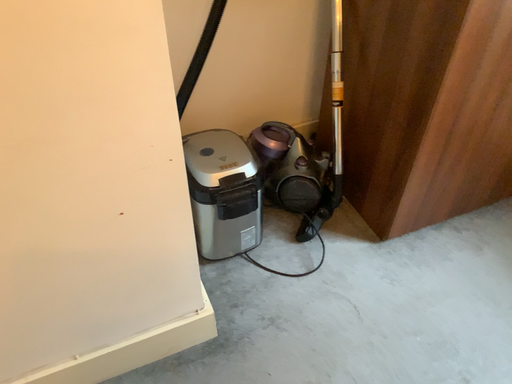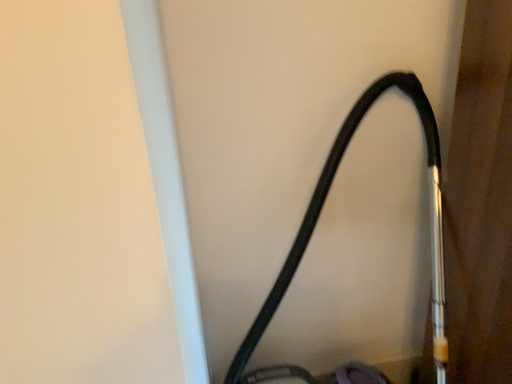
Question: Which way did the camera rotate in the video?

Choices:
 (A) rotated left
 (B) rotated right

Answer: (A)